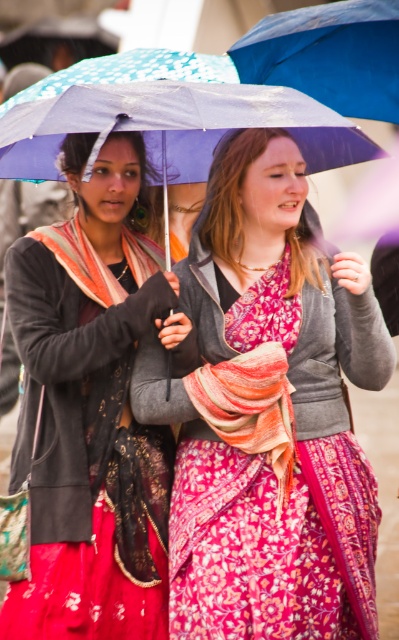
Question: Which point is closer to the camera?

Choices:
 (A) matte black scarf at left
 (B) blue fabric umbrella at upper center

Answer: (A)

Question: Is matte purple umbrella at center smaller than matte black scarf at left?

Choices:
 (A) no
 (B) yes

Answer: (A)

Question: Does matte black scarf at left appear on the left side of blue fabric umbrella at upper center?

Choices:
 (A) yes
 (B) no

Answer: (A)

Question: Where is matte purple umbrella at center located in relation to blue fabric umbrella at upper center in the image?

Choices:
 (A) below
 (B) above

Answer: (A)

Question: Which of the following is the closest to the observer?

Choices:
 (A) (286, 26)
 (B) (254, 584)

Answer: (B)

Question: Which point is farther from the camera taking this photo?

Choices:
 (A) (298, 275)
 (B) (312, 81)
 (C) (106, 326)

Answer: (B)